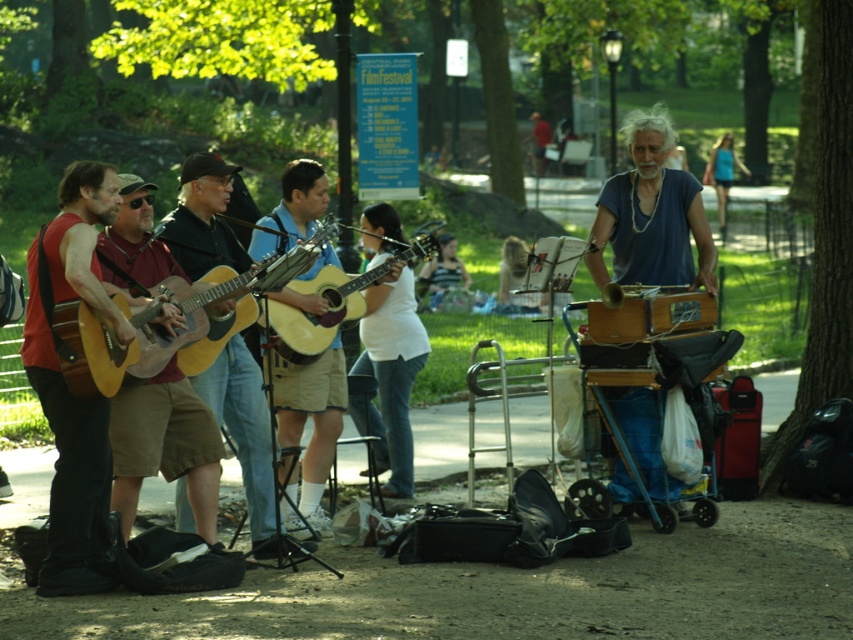
Is wooden acoustic guitar at center wider than acoustic wood guitar at center?

In fact, wooden acoustic guitar at center might be narrower than acoustic wood guitar at center.

Locate an element on the screen. The image size is (853, 640). wooden acoustic guitar at center is located at coordinates (245, 429).

Who is positioned more to the left, blue fabric shirt at right or acoustic wood guitar at center?

acoustic wood guitar at center

Which is below, blue fabric shirt at right or acoustic wood guitar at center?

acoustic wood guitar at center

Is point (668, 182) positioned in front of point (373, 276)?

That is True.

Where is `blue fabric shirt at right`? Image resolution: width=853 pixels, height=640 pixels. blue fabric shirt at right is located at coordinates (651, 214).

Is red matte guitar at left wider than blue fabric shirt at right?

Incorrect, red matte guitar at left's width does not surpass blue fabric shirt at right's.

The image size is (853, 640). In order to click on red matte guitar at left in this screenshot , I will do `click(67, 387)`.

Locate an element on the screen. The width and height of the screenshot is (853, 640). red matte guitar at left is located at coordinates (67, 387).